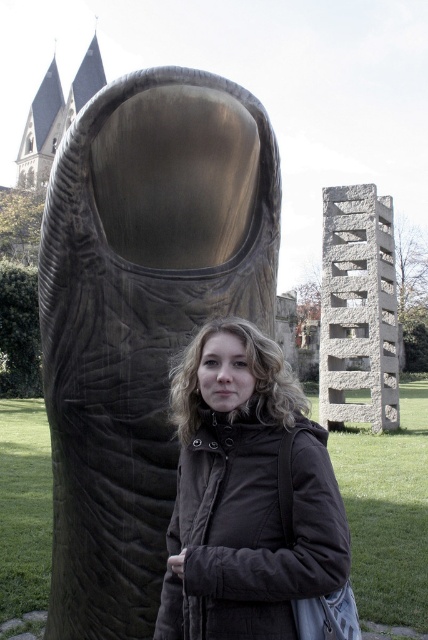
Question: In this image, where is bronze textured sculpture at center located relative to dark brown quilted jacket at center?

Choices:
 (A) right
 (B) left

Answer: (B)

Question: Is bronze textured sculpture at center smaller than dark brown quilted jacket at center?

Choices:
 (A) yes
 (B) no

Answer: (B)

Question: Does bronze textured sculpture at center appear under dark brown quilted jacket at center?

Choices:
 (A) no
 (B) yes

Answer: (A)

Question: Among these objects, which one is nearest to the camera?

Choices:
 (A) bronze textured sculpture at center
 (B) dark brown quilted jacket at center

Answer: (B)

Question: Among these points, which one is nearest to the camera?

Choices:
 (A) (216, 513)
 (B) (165, 408)

Answer: (A)

Question: Which of the following is the farthest from the observer?

Choices:
 (A) bronze textured sculpture at center
 (B) dark brown quilted jacket at center

Answer: (A)